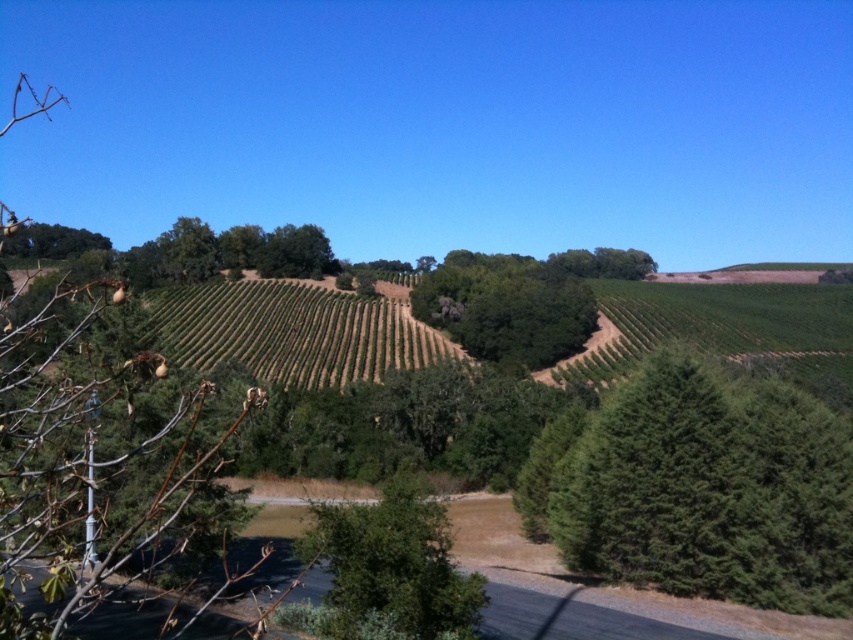
Is point (521, 483) behind point (335, 554)?

Yes.

Is green textured tree at center-right shorter than green leafy tree at center?

No.

What do you see at coordinates (699, 486) in the screenshot? The image size is (853, 640). I see `green textured tree at center-right` at bounding box center [699, 486].

The width and height of the screenshot is (853, 640). In order to click on green textured tree at center-right in this screenshot , I will do `click(699, 486)`.